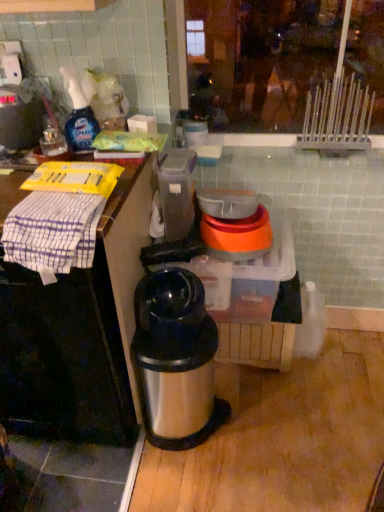
This screenshot has height=512, width=384. Find the location of `free location in front of stainless steel thermos at center`. free location in front of stainless steel thermos at center is located at coordinates (189, 480).